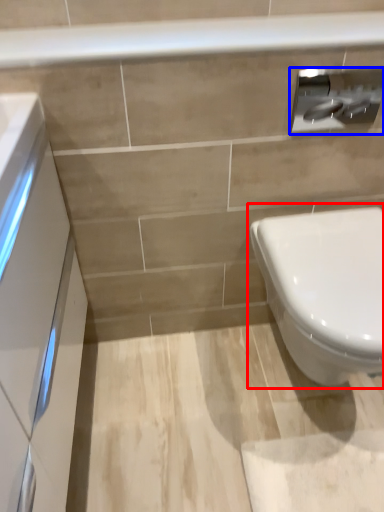
Question: Which point is further to the camera, toilet (highlighted by a red box) or toilet paper (highlighted by a blue box)?

Choices:
 (A) toilet
 (B) toilet paper

Answer: (B)